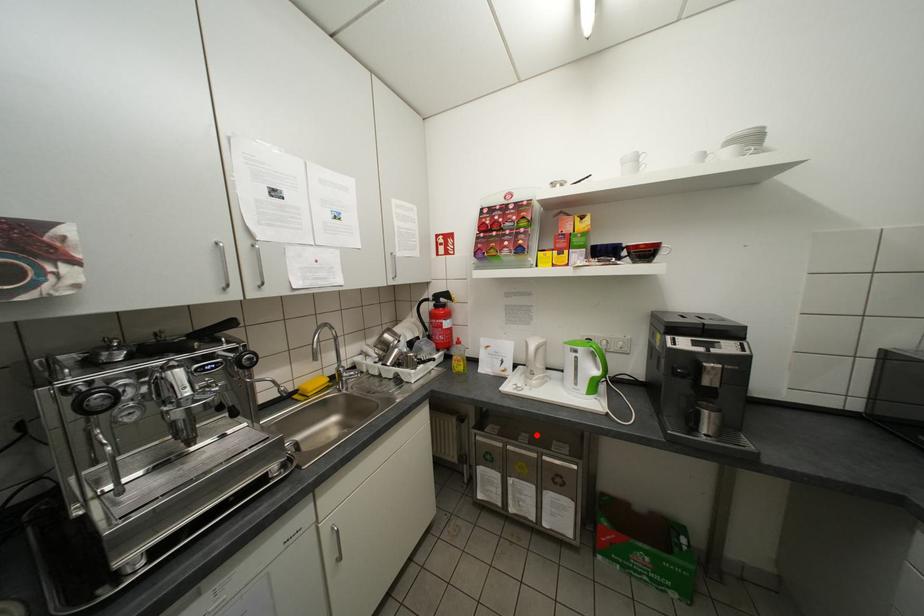
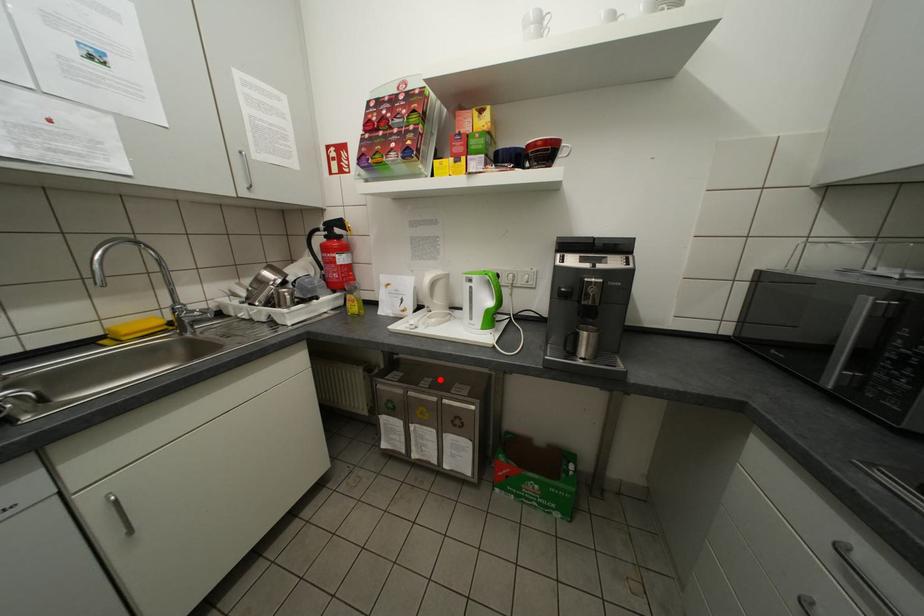
Consider the image. I am providing you with two images of the same scene from different viewpoints. A red point is marked on the first image and another point is marked on the second image. Is the red point in image1 aligned with the point shown in image2?

Yes